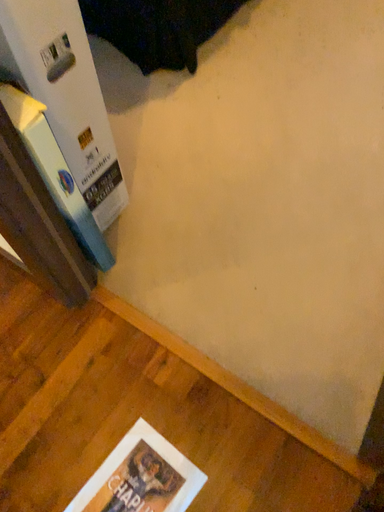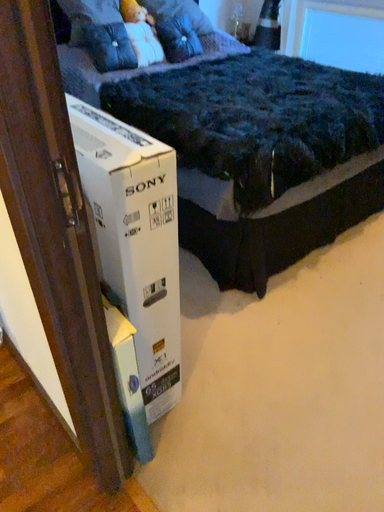
Question: How did the camera likely rotate when shooting the video?

Choices:
 (A) rotated upward
 (B) rotated downward

Answer: (A)